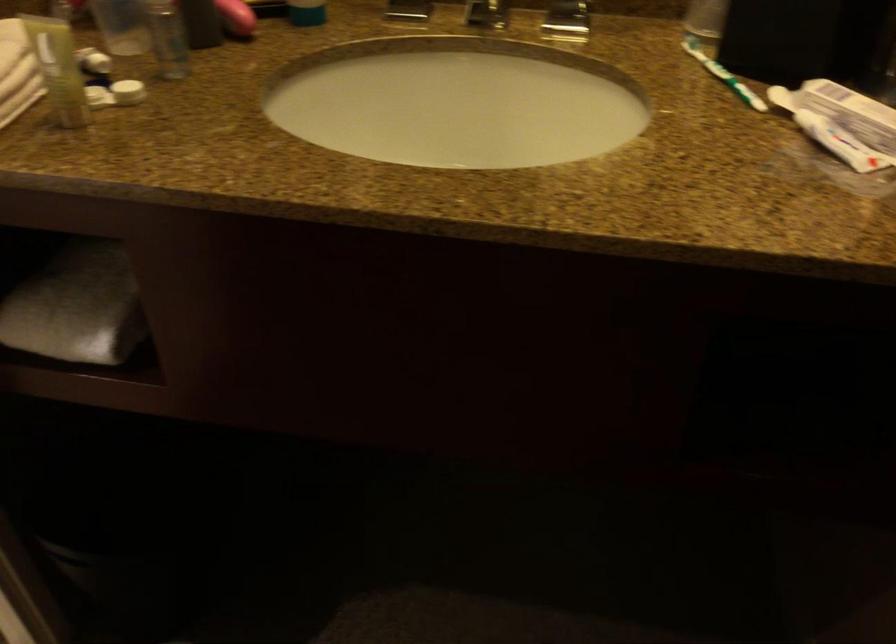
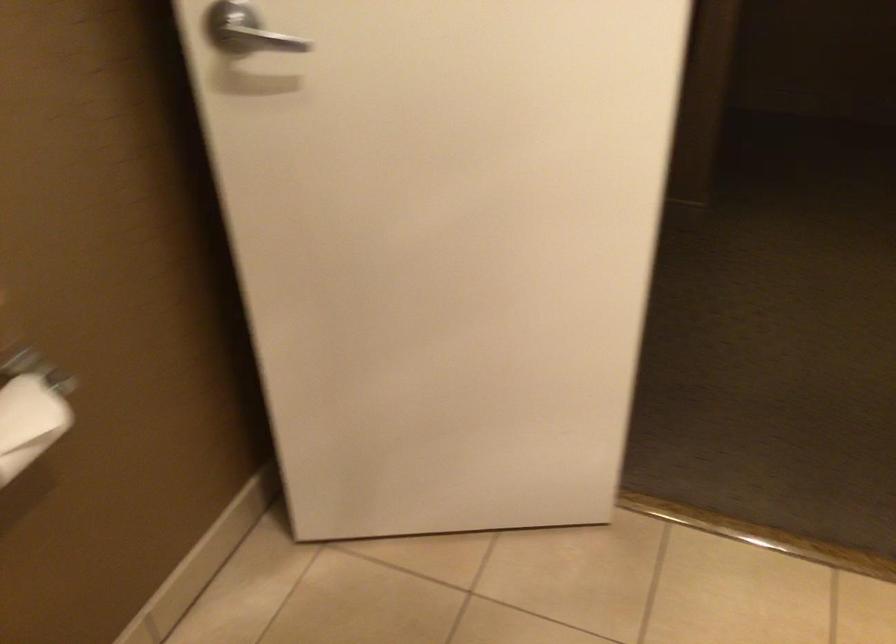
Question: I am providing you with two images of the same scene from different viewpoints. Please identify which objects are invisible in image2.

Choices:
 (A) fan adjustment handle
 (B) toilet paper roll
 (C) folded white towel
 (D) silver door handle

Answer: (C)